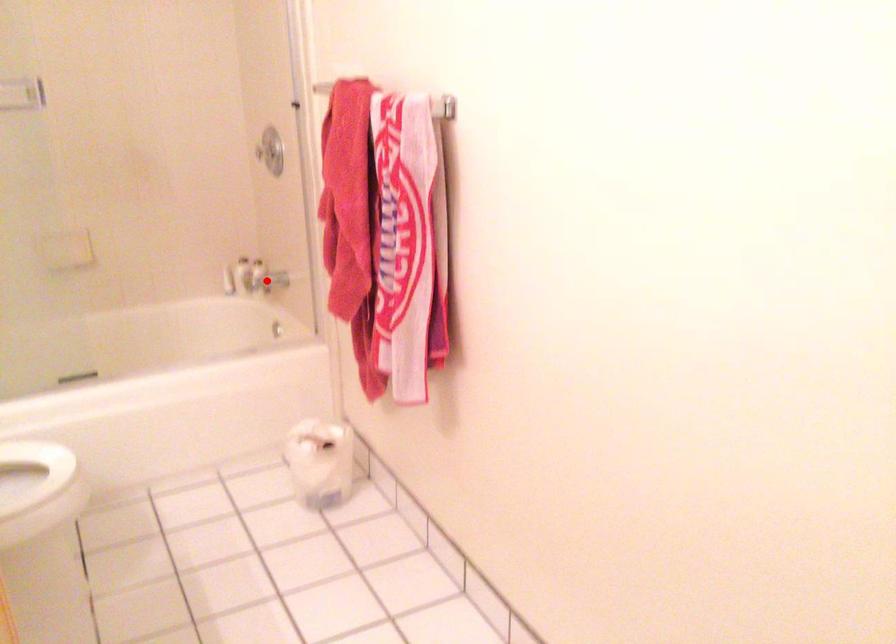
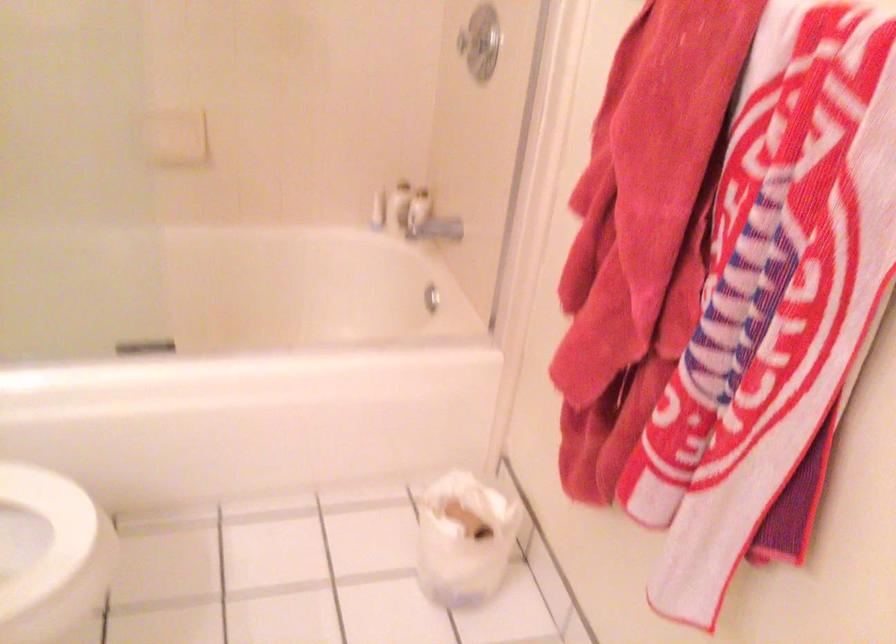
Question: I am providing you with two images of the same scene from different viewpoints. A red point is shown in image1. For the corresponding object point in image2, is it positioned nearer or farther from the camera?

Choices:
 (A) Nearer
 (B) Farther

Answer: (A)